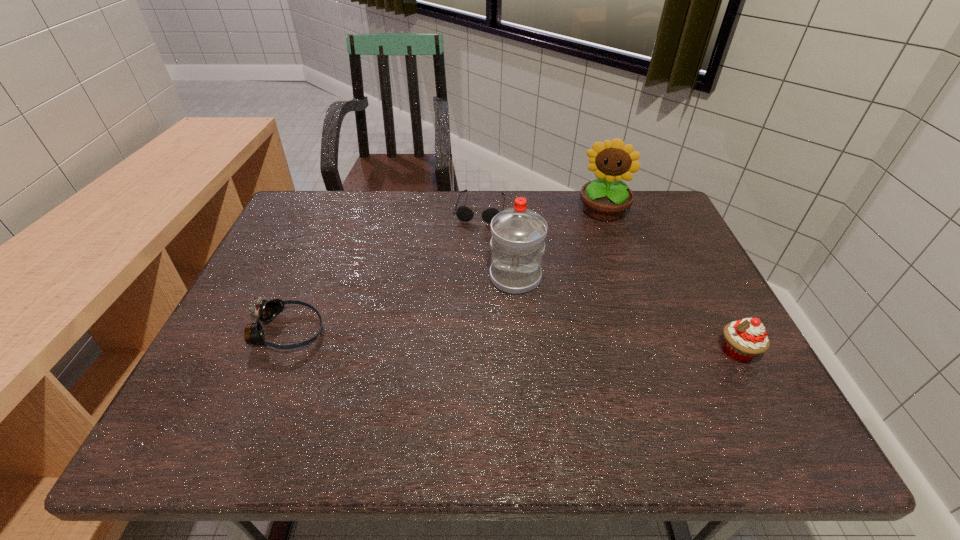
Locate an element on the screen. This screenshot has height=540, width=960. free space on the desktop that is between the leftmost object and the third tallest object and is positioned on the face of the sunflower is located at coordinates (568, 345).

Where is `free spot on the desktop that is between the leftmost object and the rightmost object and is positioned on the handle side of the water bottle`? Image resolution: width=960 pixels, height=540 pixels. free spot on the desktop that is between the leftmost object and the rightmost object and is positioned on the handle side of the water bottle is located at coordinates (506, 341).

The width and height of the screenshot is (960, 540). What are the coordinates of `vacant spot on the desktop that is between the leftmost object and the cupcake and is positioned on the front-facing side of the sunglasses` in the screenshot? It's located at (449, 339).